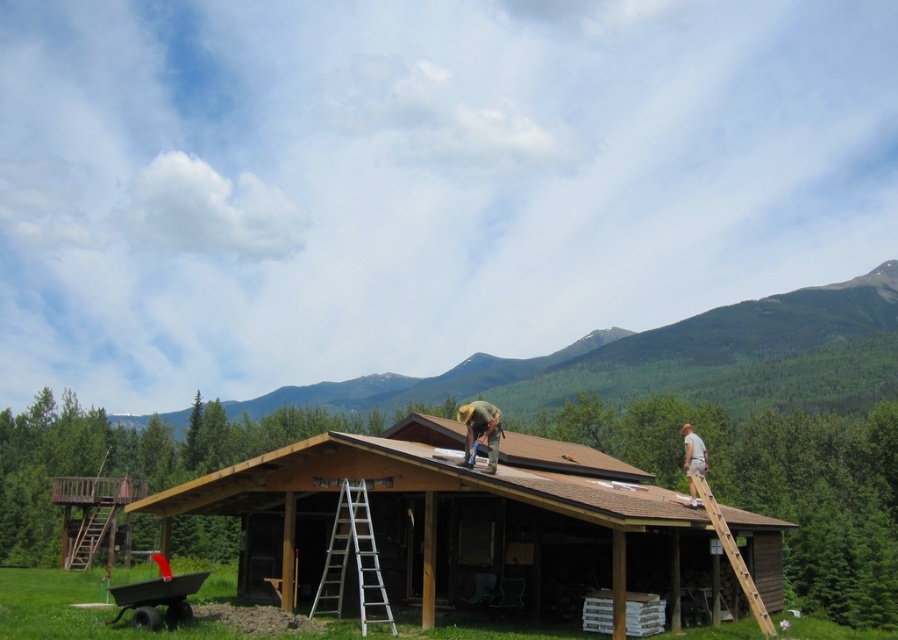
You are a visitor walking through the forest and come across this rustic wooden structure. You need to climb up to the roof to retrieve a tool left by the workers. The silver metallic ladder at lower center and the green fabric construction worker at center are in your path. Can you use the ladder to reach the roof safely?

The silver metallic ladder at lower center is shorter than the green fabric construction worker at center. Since the ladder is shorter than the worker, it might not reach the roof. You should check if the ladder is tall enough before attempting to climb it.

You are a construction worker standing at the base of the building. You need to place the brown shingles at center onto the roof. The camera is positioned where you are standing. Can you safely lift the shingles from your current position to the roof without needing to move closer? Please consider the distance between you and the shingles.

The brown shingles at center and the camera are 76.77 feet apart. Since the camera is at your current position, the distance is too far to safely lift the shingles to the roof without moving closer.